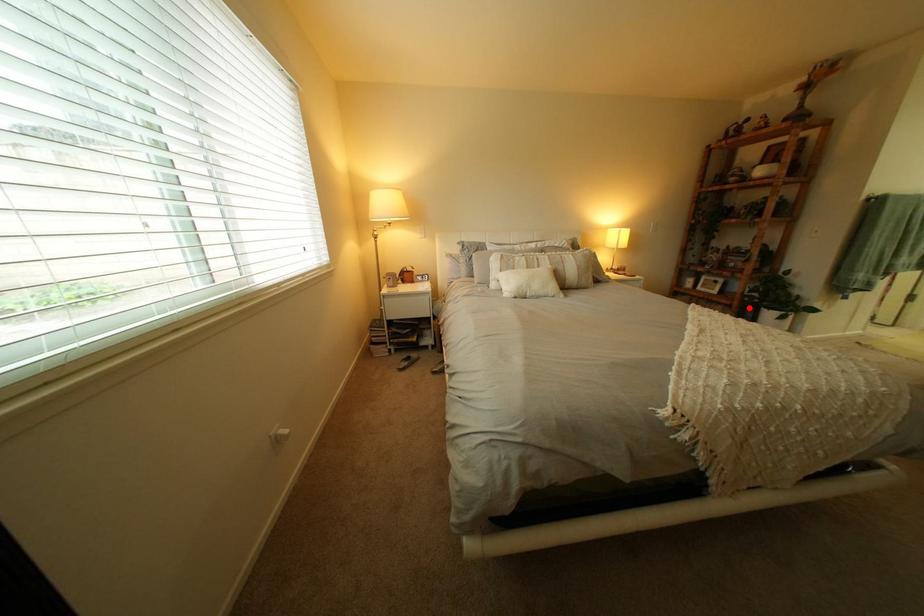
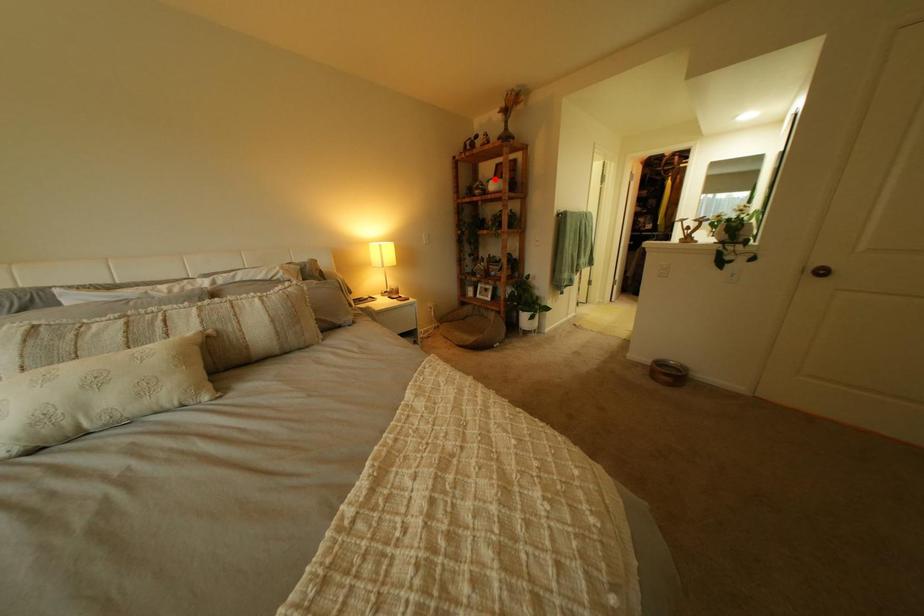
I am providing you with two images of the same scene from different viewpoints. A red point is marked on the first image and another point is marked on the second image. Are the points marked in image1 and image2 representing the same 3D position?

No